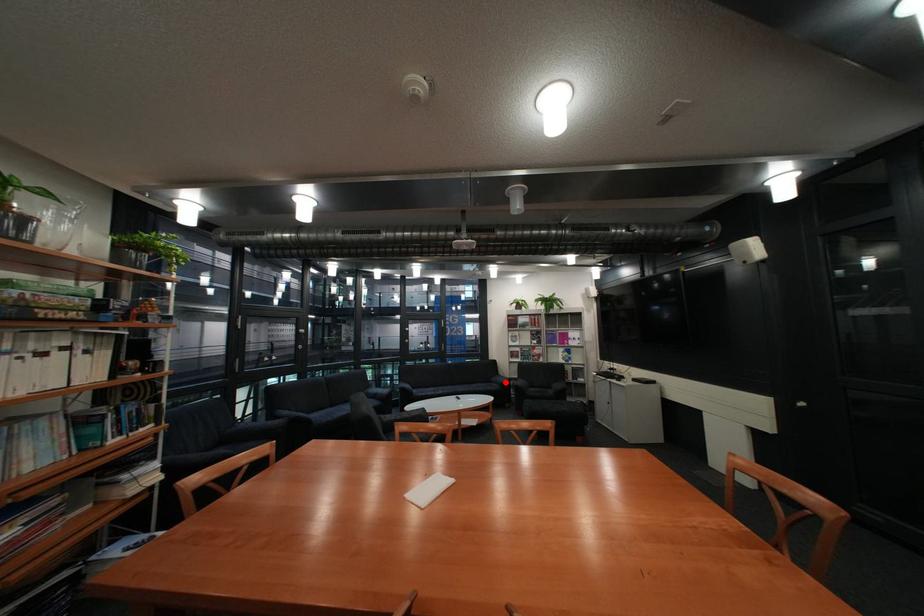
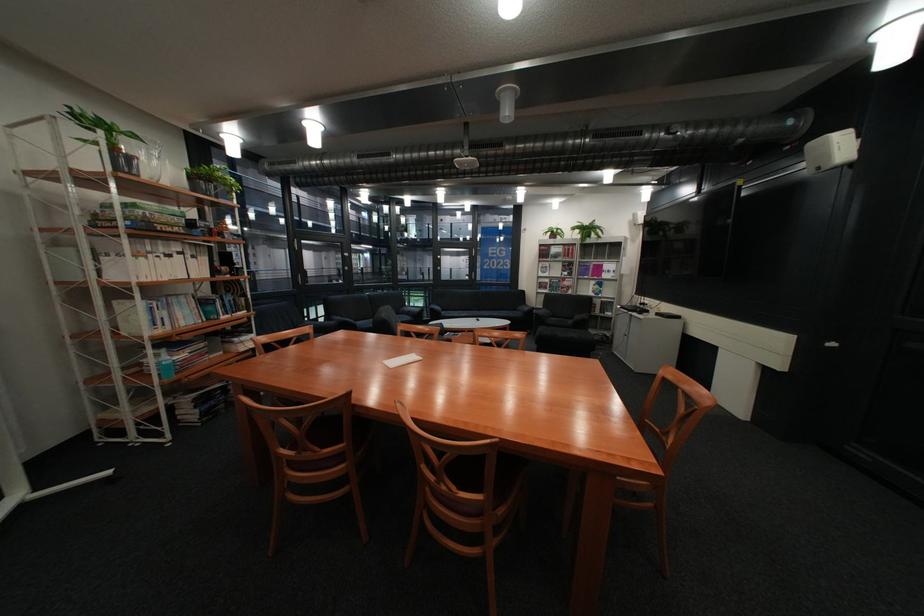
Question: I am providing you with two images of the same scene from different viewpoints. Given a red point in image1, look at the same physical point in image2. Is it:

Choices:
 (A) Closer to the viewpoint
 (B) Farther from the viewpoint

Answer: (A)